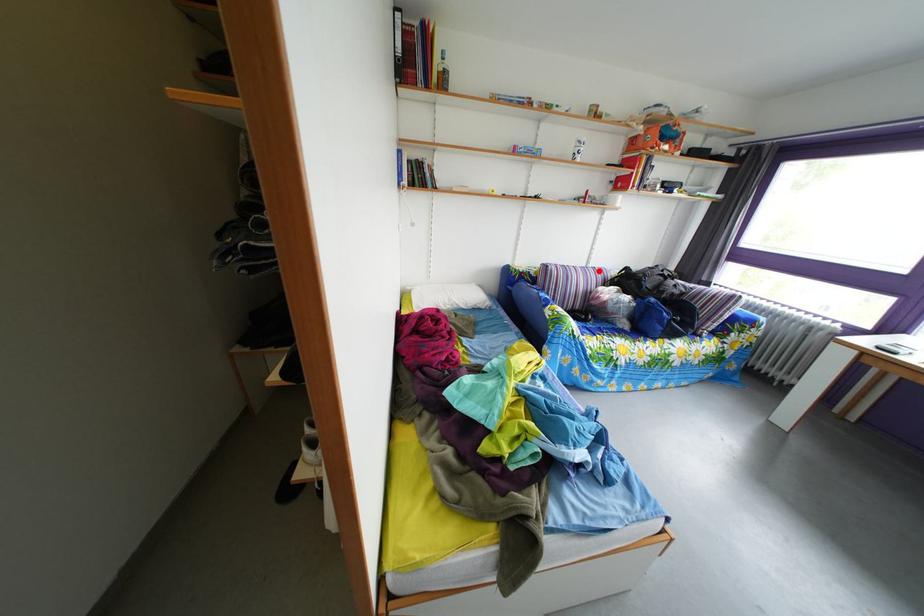
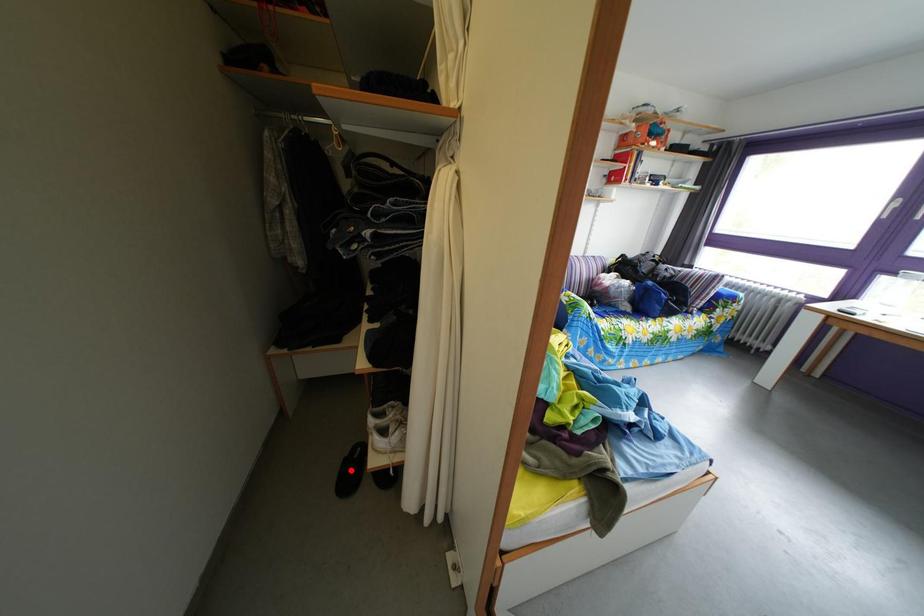
I am providing you with two images of the same scene from different viewpoints. A red point is marked on the first image and another point is marked on the second image. Is the marked point in image1 the same physical position as the marked point in image2?

No